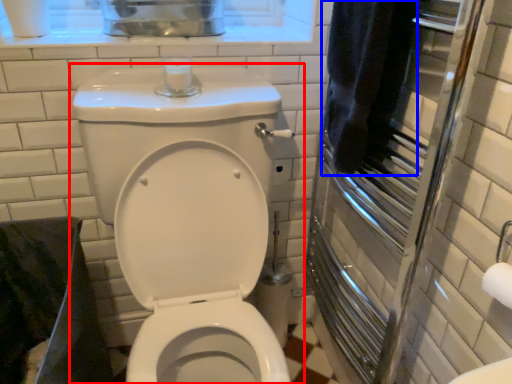
Question: Which object appears farthest to the camera in this image, toilet (highlighted by a red box) or bath towel (highlighted by a blue box)?

Choices:
 (A) toilet
 (B) bath towel

Answer: (B)